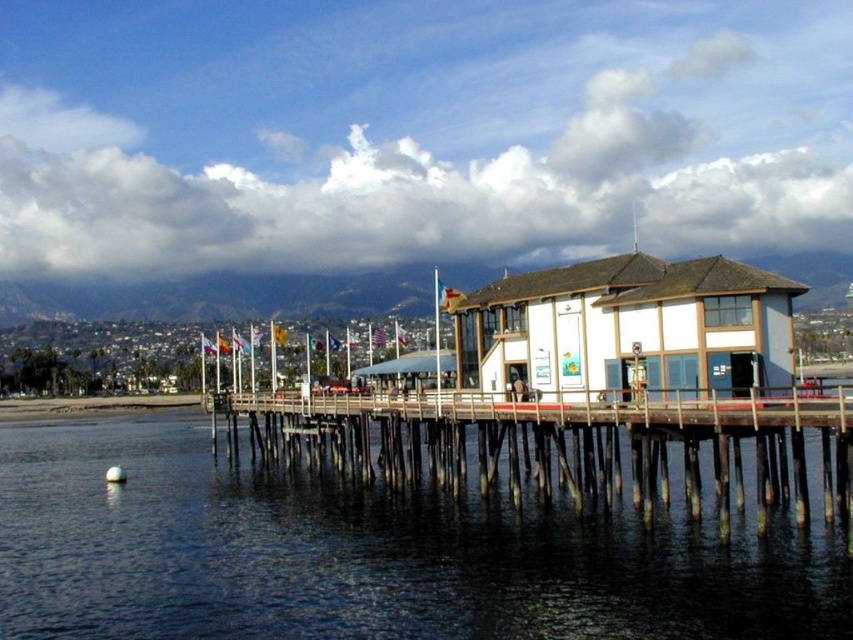
Find the location of a particular element. This screenshot has width=853, height=640. wooden at center is located at coordinates (564, 445).

What do you see at coordinates (564, 445) in the screenshot?
I see `wooden at center` at bounding box center [564, 445].

Does point (376, 420) come in front of point (437, 346)?

That is False.

I want to click on wooden at center, so click(564, 445).

Between dark blue water at lower left and wooden at center, which one is positioned lower?

dark blue water at lower left is lower down.

Does dark blue water at lower left have a lesser height compared to wooden at center?

Correct, dark blue water at lower left is not as tall as wooden at center.

Locate an element on the screen. dark blue water at lower left is located at coordinates (374, 554).

Where is `dark blue water at lower left`? Image resolution: width=853 pixels, height=640 pixels. dark blue water at lower left is located at coordinates (374, 554).

Is dark blue water at lower left thinner than metallic flagpole at center?

Incorrect, dark blue water at lower left's width is not less than metallic flagpole at center's.

Consider the image. Which is above, dark blue water at lower left or metallic flagpole at center?

metallic flagpole at center

Which is in front, point (453, 586) or point (437, 268)?

Point (453, 586) is in front.

The width and height of the screenshot is (853, 640). Find the location of `dark blue water at lower left`. dark blue water at lower left is located at coordinates (374, 554).